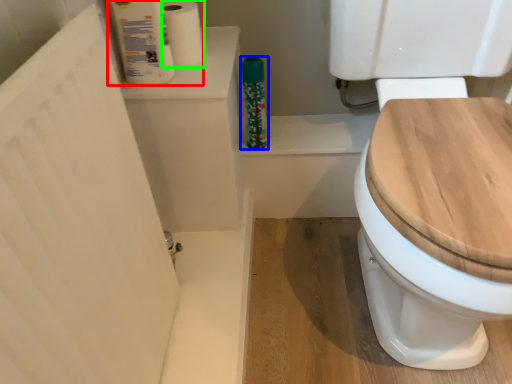
Question: Based on their relative distances, which object is nearer to toilet paper (highlighted by a red box)? Choose from cleaning product (highlighted by a blue box) and toilet paper (highlighted by a green box).

Choices:
 (A) cleaning product
 (B) toilet paper

Answer: (B)